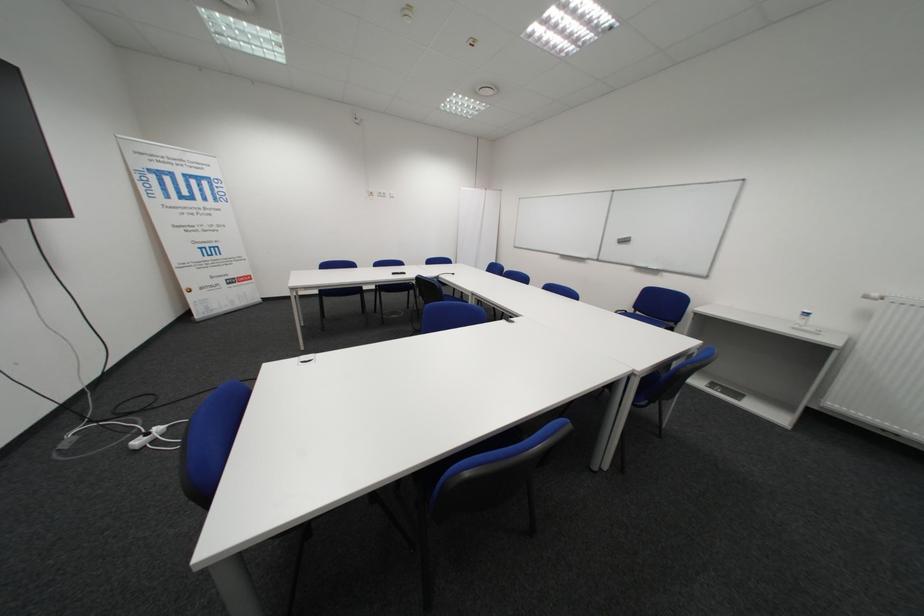
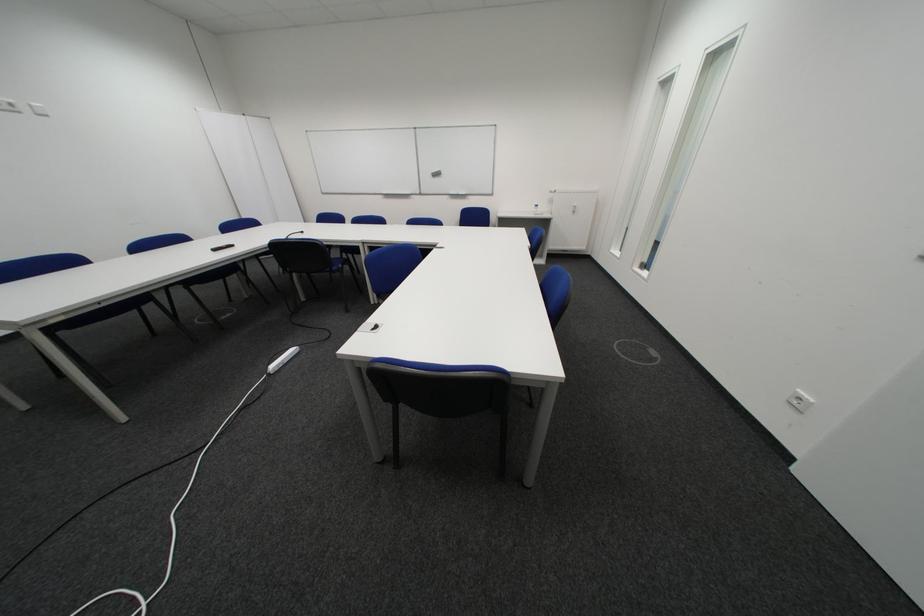
In the second image, find the point that corresponds to pixel 808 328 in the first image.

(548, 215)